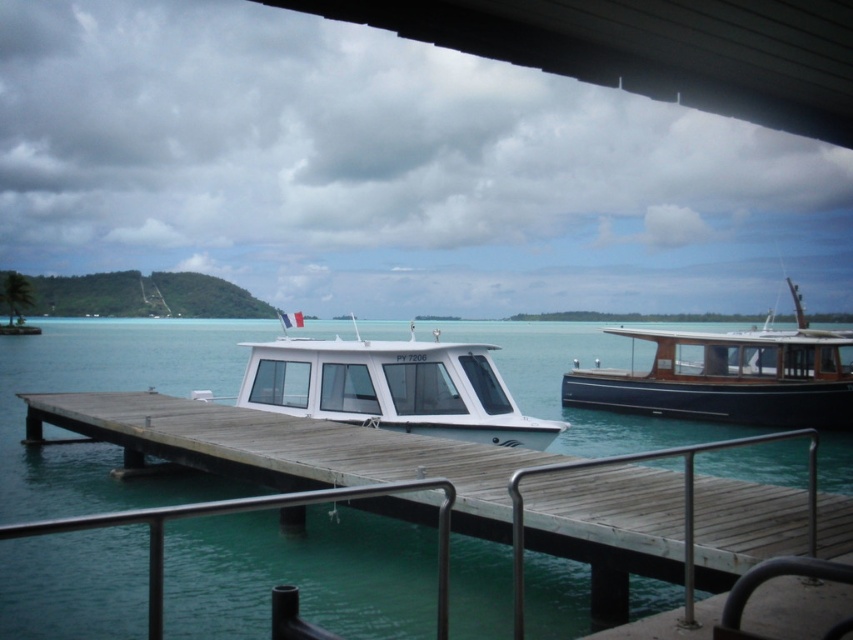
You are a dock attendant who needs to determine if both boats can be moored side by side in a space that is 10 meters wide. The white glossy boat at center is 3 meters wide and the dark blue polished wood boat at right is 4 meters wide. Can they fit without overlapping?

The white glossy boat at center is 3 meters wide and the dark blue polished wood boat at right is 4 meters wide. Combined, they total 7 meters, which is less than the 10 meters available. Therefore, they can fit side by side without overlapping.